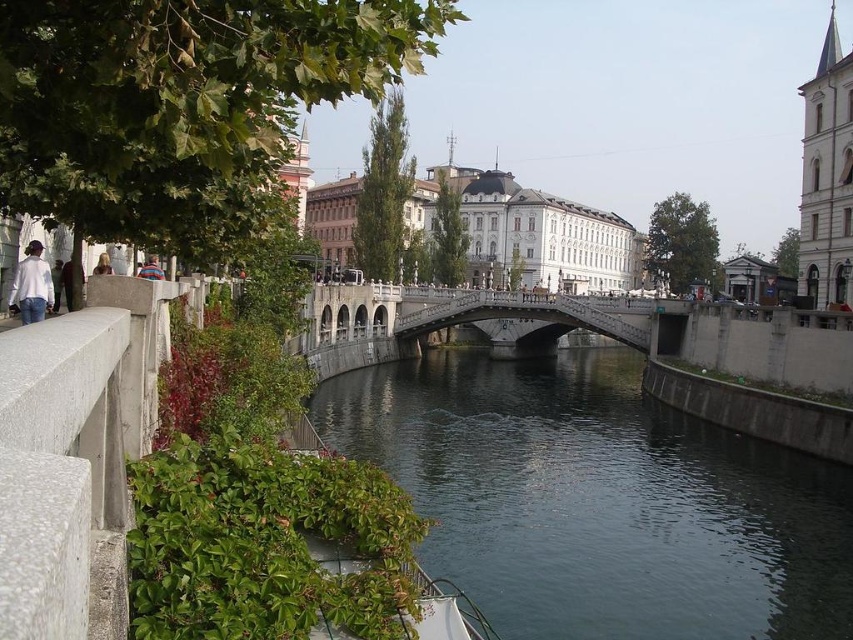
Is green concrete river at center shorter than white stone bridge at center?

In fact, green concrete river at center may be taller than white stone bridge at center.

Is point (465, 435) positioned after point (488, 308)?

No.

Does point (463, 420) lie behind point (364, 308)?

No, (463, 420) is closer to viewer.

At what (x,y) coordinates should I click in order to perform the action: click on green concrete river at center. Please return your answer as a coordinate pair (x, y). Looking at the image, I should click on (599, 500).

Does green concrete river at center have a larger size compared to light brown leather jacket at upper left?

Correct, green concrete river at center is larger in size than light brown leather jacket at upper left.

From the picture: Measure the distance between green concrete river at center and camera.

The distance of green concrete river at center from camera is 52.03 meters.

Locate an element on the screen. This screenshot has width=853, height=640. green concrete river at center is located at coordinates (599, 500).

Who is higher up, white stone bridge at center or white matte shirt at left?

white matte shirt at left

Does white stone bridge at center have a greater height compared to white matte shirt at left?

Indeed, white stone bridge at center has a greater height compared to white matte shirt at left.

Which is behind, point (363, 305) or point (28, 323)?

The point (363, 305) is behind.

The image size is (853, 640). Identify the location of white stone bridge at center. (457, 323).